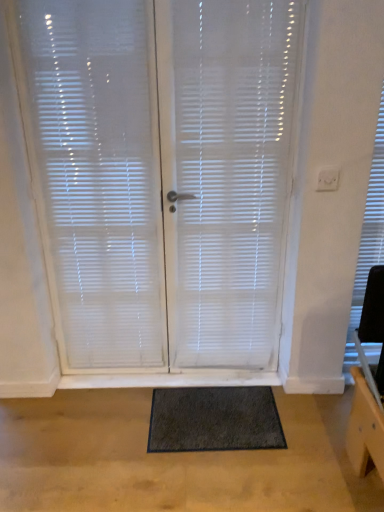
Measure the distance between point (183, 398) and camera.

Point (183, 398) and camera are 6.97 feet apart from each other.

Image resolution: width=384 pixels, height=512 pixels. Describe the element at coordinates (231, 176) in the screenshot. I see `white translucent blinds at center` at that location.

Measure the distance between white translucent blinds at center and camera.

The distance of white translucent blinds at center from camera is 1.62 meters.

At what (x,y) coordinates should I click in order to perform the action: click on dark gray shaggy mat at center. Please return your answer as a coordinate pair (x, y). Image resolution: width=384 pixels, height=512 pixels. Looking at the image, I should click on (214, 419).

Looking at this image, is white translucent blinds at center far away from dark gray shaggy mat at center?

No, white translucent blinds at center is in close proximity to dark gray shaggy mat at center.

From the image's perspective, between white translucent blinds at center and dark gray shaggy mat at center, which one is located above?

From the image's view, white translucent blinds at center is above.

Is point (40, 79) farther from viewer compared to point (189, 451)?

No, it is not.

In the scene shown: Which is farther, (221, 71) or (214, 65)?

The point (221, 71) is farther from the camera.

Which of these two, white translucent blinds at center or white translucent blinds at center, is bigger?

white translucent blinds at center is bigger.

Can white translucent blinds at center be found inside white translucent blinds at center?

Absolutely, white translucent blinds at center is inside white translucent blinds at center.

Considering the sizes of white translucent blinds at center and white translucent blinds at center in the image, is white translucent blinds at center wider or thinner than white translucent blinds at center?

Considering their sizes, white translucent blinds at center looks slimmer than white translucent blinds at center.

Find the location of a particular element. window blind that is behind the white translucent blinds at center is located at coordinates (163, 176).

Considering the relative sizes of white translucent blinds at center and white translucent blinds at center in the image provided, is white translucent blinds at center bigger than white translucent blinds at center?

Yes.

Would you say white translucent blinds at center is outside white translucent blinds at center?

No, white translucent blinds at center is not outside of white translucent blinds at center.

Looking at this image, what's the angular difference between white translucent blinds at center and white translucent blinds at center's facing directions?

The angle between the facing direction of white translucent blinds at center and the facing direction of white translucent blinds at center is 0.000404 degrees.

Considering the relative sizes of white translucent blinds at center and dark gray shaggy mat at center in the image provided, is white translucent blinds at center wider than dark gray shaggy mat at center?

No.

Would you say white translucent blinds at center is inside or outside dark gray shaggy mat at center?

white translucent blinds at center exists outside the volume of dark gray shaggy mat at center.

Find the location of a particular element. The width and height of the screenshot is (384, 512). doormat on the left of white translucent blinds at center is located at coordinates (214, 419).

Considering the sizes of objects white translucent blinds at center and dark gray shaggy mat at center in the image provided, who is taller, white translucent blinds at center or dark gray shaggy mat at center?

white translucent blinds at center.

Does dark gray shaggy mat at center turn towards white translucent blinds at center?

No.

Relative to white translucent blinds at center, is dark gray shaggy mat at center in front or behind?

In the image, dark gray shaggy mat at center appears behind white translucent blinds at center.

Does dark gray shaggy mat at center have a lesser width compared to white translucent blinds at center?

In fact, dark gray shaggy mat at center might be wider than white translucent blinds at center.

Consider the image. Considering the relative positions of white painted wood at lower center and white translucent blinds at center in the image provided, is white painted wood at lower center to the right of white translucent blinds at center from the viewer's perspective?

No, white painted wood at lower center is not to the right of white translucent blinds at center.

Which is further, (264, 383) or (223, 131)?

The point (264, 383) is behind.

Is white painted wood at lower center completely or partially outside of white translucent blinds at center?

white painted wood at lower center is positioned outside white translucent blinds at center.

Based on their sizes in the image, would you say white painted wood at lower center is bigger or smaller than white translucent blinds at center?

Clearly, white painted wood at lower center is smaller in size than white translucent blinds at center.

How different are the orientations of white translucent blinds at center and white painted wood at lower center in degrees?

The angle between the facing direction of white translucent blinds at center and the facing direction of white painted wood at lower center is 0.896 degrees.

Is white translucent blinds at center bigger or smaller than white painted wood at lower center?

In the image, white translucent blinds at center appears to be larger than white painted wood at lower center.

Which point is more forward, (176, 159) or (261, 375)?

Point (176, 159)

Considering the positions of objects white translucent blinds at center and white painted wood at lower center in the image provided, who is more to the left, white translucent blinds at center or white painted wood at lower center?

Positioned to the left is white painted wood at lower center.

Image resolution: width=384 pixels, height=512 pixels. In order to click on doormat behind the white translucent blinds at center in this screenshot , I will do `click(214, 419)`.

Locate an element on the screen. This screenshot has width=384, height=512. window blind below the white translucent blinds at center (from a real-world perspective) is located at coordinates (163, 176).

Considering their positions, is dark gray shaggy mat at center positioned closer to white painted wood at lower center than white translucent blinds at center?

dark gray shaggy mat at center is positioned closer to the anchor white painted wood at lower center.

Based on their spatial positions, is white painted wood at lower center or white translucent blinds at center closer to white translucent blinds at center?

Based on the image, white translucent blinds at center appears to be nearer to white translucent blinds at center.

Looking at the image, which one is located further to dark gray shaggy mat at center, white translucent blinds at center or white painted wood at lower center?

white translucent blinds at center is positioned further to the anchor dark gray shaggy mat at center.

Considering their positions, is dark gray shaggy mat at center positioned closer to white painted wood at lower center than white translucent blinds at center?

Among the two, dark gray shaggy mat at center is located nearer to white painted wood at lower center.

Looking at the image, which one is located closer to white translucent blinds at center, white translucent blinds at center or white painted wood at lower center?

Among the two, white translucent blinds at center is located nearer to white translucent blinds at center.

When comparing their distances from dark gray shaggy mat at center, does white painted wood at lower center or white translucent blinds at center seem closer?

Based on the image, white painted wood at lower center appears to be nearer to dark gray shaggy mat at center.

Which object lies further to the anchor point white painted wood at lower center, white translucent blinds at center or dark gray shaggy mat at center?

white translucent blinds at center lies further to white painted wood at lower center than the other object.

Based on their spatial positions, is white translucent blinds at center or dark gray shaggy mat at center further from white translucent blinds at center?

Among the two, dark gray shaggy mat at center is located further to white translucent blinds at center.

The width and height of the screenshot is (384, 512). I want to click on window sill between white translucent blinds at center and dark gray shaggy mat at center from top to bottom, so click(x=171, y=379).

Find the location of a particular element. The image size is (384, 512). window blind that lies between white translucent blinds at center and white painted wood at lower center from top to bottom is located at coordinates (163, 176).

Find the location of a particular element. The height and width of the screenshot is (512, 384). window blind between white translucent blinds at center and dark gray shaggy mat at center vertically is located at coordinates (163, 176).

Where is `window sill between white translucent blinds at center and dark gray shaggy mat at center vertically`? The height and width of the screenshot is (512, 384). window sill between white translucent blinds at center and dark gray shaggy mat at center vertically is located at coordinates (171, 379).